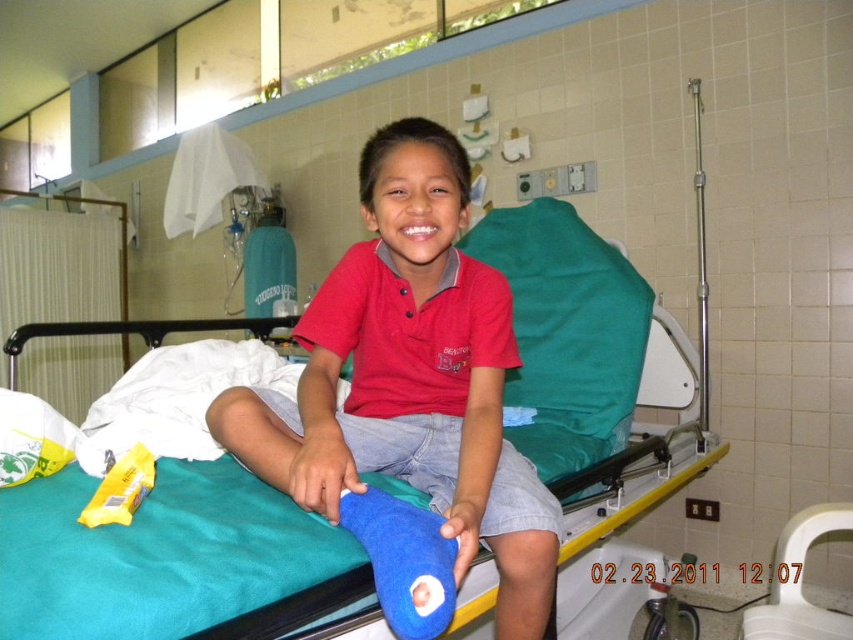
Does teal fabric hospital bed at center appear on the right side of red cotton shirt at center?

Indeed, teal fabric hospital bed at center is positioned on the right side of red cotton shirt at center.

Does point (543, 420) lie in front of point (368, 214)?

No, (543, 420) is behind (368, 214).

Is point (581, 369) more distant than point (273, 394)?

Yes.

Find the location of a particular element. This screenshot has width=853, height=640. teal fabric hospital bed at center is located at coordinates (165, 560).